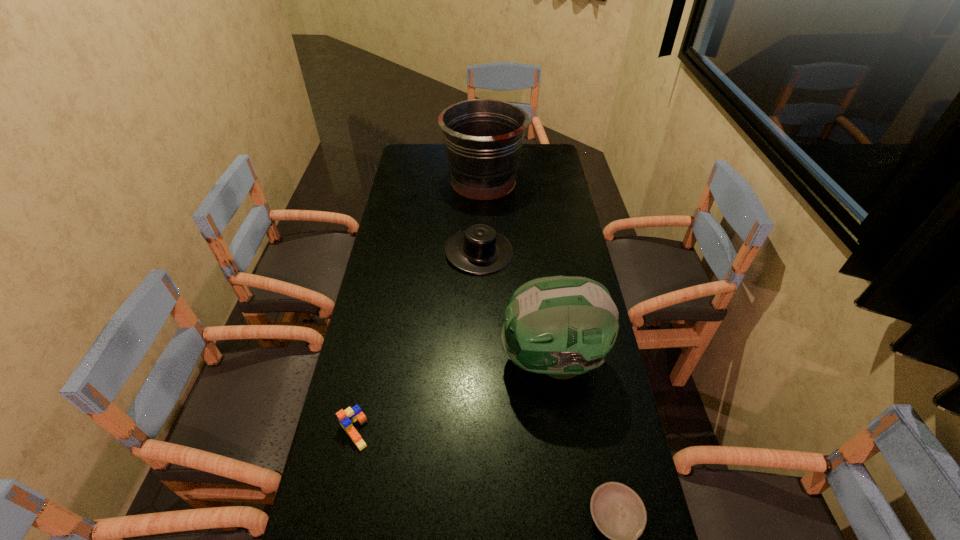
Find the location of a particular element. The image size is (960, 540). vacant area that lies between the Lego and the football helmet is located at coordinates click(x=453, y=395).

Where is `free area in between the leftmost object and the second farthest object`? free area in between the leftmost object and the second farthest object is located at coordinates (417, 341).

What are the coordinates of `vacant area between the fourth farthest object and the third nearest object` in the screenshot? It's located at (453, 395).

Where is `vacant space that is in between the second shortest object and the third tallest object`? Image resolution: width=960 pixels, height=540 pixels. vacant space that is in between the second shortest object and the third tallest object is located at coordinates (417, 341).

Identify the location of object that stands as the closest to the third farthest object. (479, 249).

Locate an element on the screen. Image resolution: width=960 pixels, height=540 pixels. the second closest object to the farthest object is located at coordinates (562, 326).

Find the location of a particular element. Image resolution: width=960 pixels, height=540 pixels. free point that satisfies the following two spatial constraints: 1. on the visor of the third farthest object; 2. on the front side of the Lego is located at coordinates (562, 430).